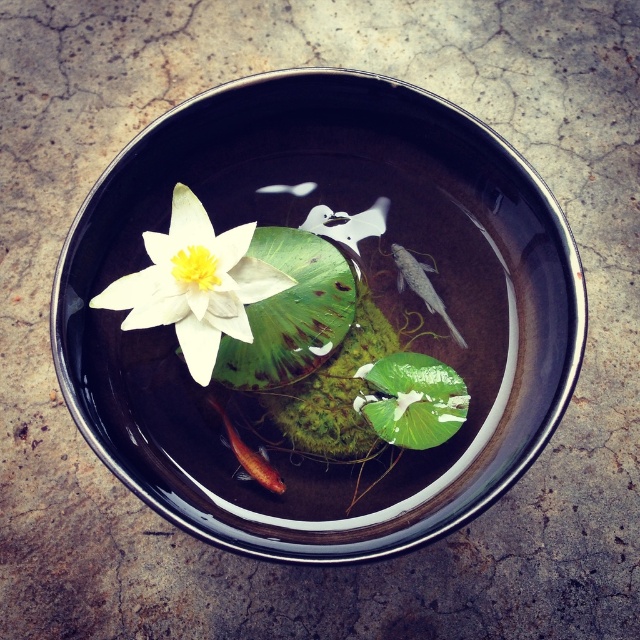
Can you confirm if white matte flower at center is positioned below shiny orange fish at center?

Actually, white matte flower at center is above shiny orange fish at center.

From the picture: Is white matte flower at center wider than shiny orange fish at center?

Yes.

The height and width of the screenshot is (640, 640). What do you see at coordinates (195, 284) in the screenshot?
I see `white matte flower at center` at bounding box center [195, 284].

Identify the location of white matte flower at center. The width and height of the screenshot is (640, 640). (195, 284).

Is black glossy bowl at center below white matte flower at center?

Indeed, black glossy bowl at center is positioned under white matte flower at center.

Which is more to the left, black glossy bowl at center or white matte flower at center?

From the viewer's perspective, white matte flower at center appears more on the left side.

The height and width of the screenshot is (640, 640). In order to click on black glossy bowl at center in this screenshot , I will do click(314, 298).

From the picture: Can you confirm if white matte flower at center is positioned below silvery metallic fish at center?

Yes, white matte flower at center is below silvery metallic fish at center.

Where is `white matte flower at center`? The height and width of the screenshot is (640, 640). white matte flower at center is located at coordinates tap(195, 284).

Locate an element on the screen. The width and height of the screenshot is (640, 640). white matte flower at center is located at coordinates (195, 284).